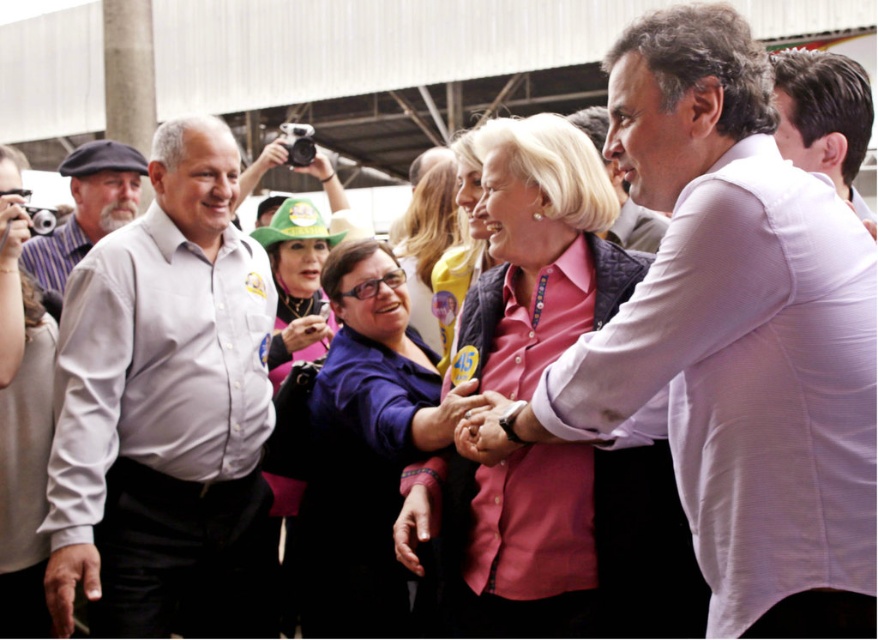
Does light gray shirt at left have a greater height compared to matte gray shirt at upper left?

Yes.

Between light gray shirt at left and matte gray shirt at upper left, which one is positioned higher?

light gray shirt at left is above.

Between point (150, 392) and point (34, 458), which one is positioned in front?

Point (34, 458)

Find the location of a particular element. This screenshot has width=878, height=640. light gray shirt at left is located at coordinates (163, 406).

Which is more to the right, matte gray shirt at upper left or light purple shirt at center?

light purple shirt at center is more to the right.

Which is above, matte gray shirt at upper left or light purple shirt at center?

light purple shirt at center is higher up.

Which is behind, point (27, 328) or point (594, 132)?

Point (594, 132)

Where is `matte gray shirt at upper left`? This screenshot has width=878, height=640. matte gray shirt at upper left is located at coordinates (20, 420).

Does light gray shirt at left come in front of matte gray cap at left?

Yes, light gray shirt at left is closer to the viewer.

Is point (58, 634) positioned before point (101, 147)?

That is True.

Which is behind, point (60, 609) or point (76, 227)?

Positioned behind is point (76, 227).

You are a GUI agent. You are given a task and a screenshot of the screen. Output one action in this format:
    pyautogui.click(x=<x>, y=<y>)
    Task: Click on the light gray shirt at left
    
    Given the screenshot: What is the action you would take?
    pyautogui.click(x=163, y=406)